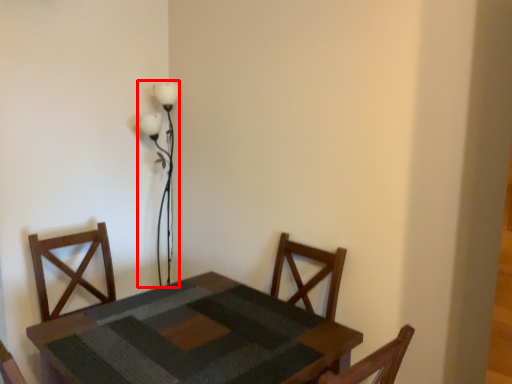
Question: In this image, where is table lamp (annotated by the red box) located relative to table?

Choices:
 (A) right
 (B) left

Answer: (B)